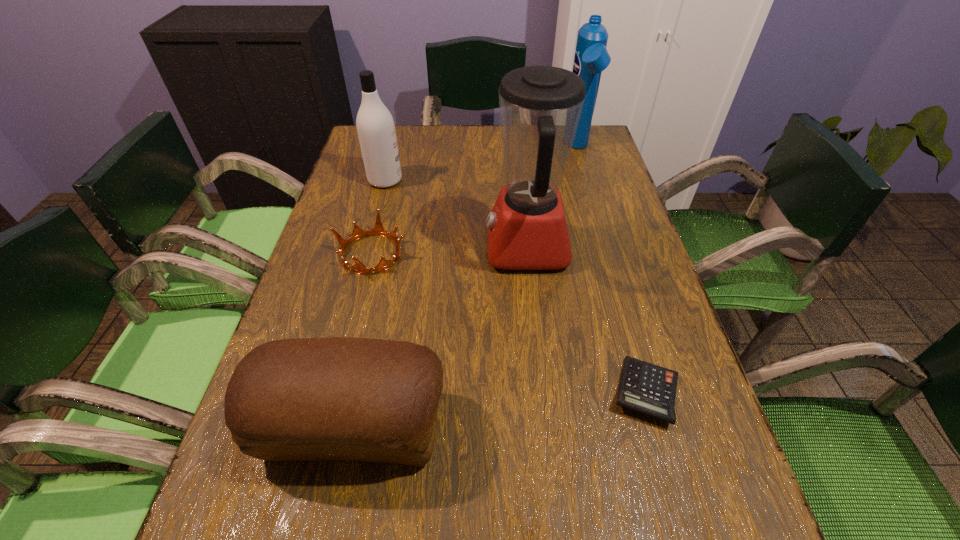
The width and height of the screenshot is (960, 540). I want to click on free space that satisfies the following two spatial constraints: 1. on the back side of the right shampoo; 2. on the right side of the fourth tallest object, so click(x=412, y=148).

Image resolution: width=960 pixels, height=540 pixels. What are the coordinates of `free space that satisfies the following two spatial constraints: 1. on the back side of the crown; 2. on the front-facing side of the fourth shortest object` in the screenshot? It's located at (390, 180).

Where is `vacant space that satisfies the following two spatial constraints: 1. on the front of the third object from right to left near the controls; 2. on the back side of the shortest object`? The height and width of the screenshot is (540, 960). vacant space that satisfies the following two spatial constraints: 1. on the front of the third object from right to left near the controls; 2. on the back side of the shortest object is located at coordinates (542, 393).

The width and height of the screenshot is (960, 540). I want to click on free space that satisfies the following two spatial constraints: 1. on the front side of the right shampoo; 2. on the front of the fourth object from left to right near the controls, so click(607, 248).

You are a GUI agent. You are given a task and a screenshot of the screen. Output one action in this format:
    pyautogui.click(x=<x>, y=<y>)
    Task: Click on the free region that satisfies the following two spatial constraints: 1. on the back side of the shortest object; 2. on the left side of the bread
    
    Given the screenshot: What is the action you would take?
    pyautogui.click(x=361, y=393)